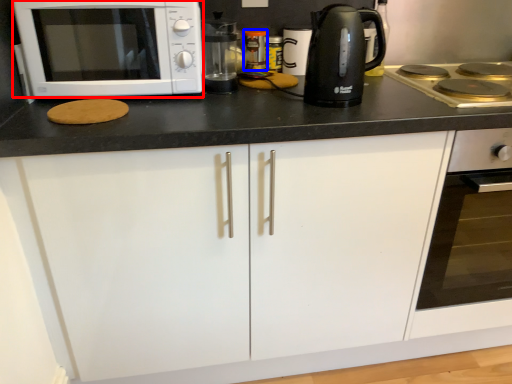
Question: Among these objects, which one is farthest to the camera, microwave oven (highlighted by a red box) or appliance (highlighted by a blue box)?

Choices:
 (A) microwave oven
 (B) appliance

Answer: (B)